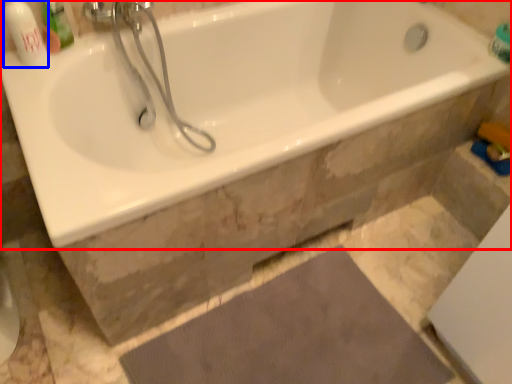
Question: Which point is further to the camera, bathtub (highlighted by a red box) or toiletry (highlighted by a blue box)?

Choices:
 (A) bathtub
 (B) toiletry

Answer: (B)